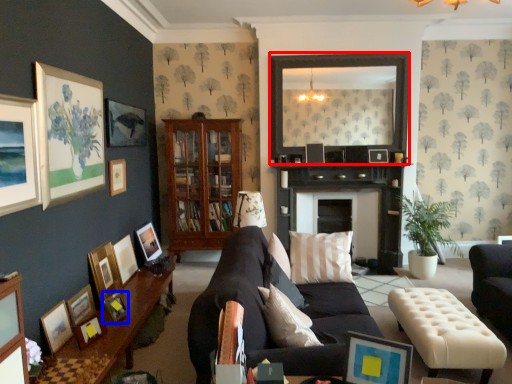
Question: Which point is closer to the camera, mirror (highlighted by a red box) or picture frame (highlighted by a blue box)?

Choices:
 (A) mirror
 (B) picture frame

Answer: (B)